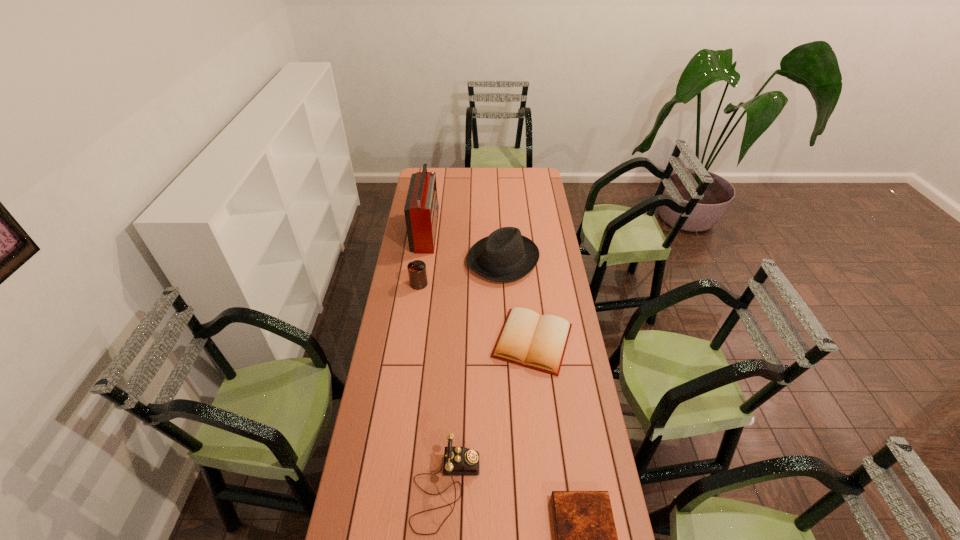
At what (x,y) coordinates should I click in order to perform the action: click on vacant space that satisfies the following two spatial constraints: 1. on the front-facing side of the can; 2. on the left side of the radio receiver. Please return your answer as a coordinate pair (x, y). This screenshot has width=960, height=540. Looking at the image, I should click on 419,284.

The height and width of the screenshot is (540, 960). In order to click on free space that satisfies the following two spatial constraints: 1. on the front-facing side of the radio receiver; 2. on the left side of the fifth tallest object in this screenshot , I will do `click(410, 341)`.

Where is `free space that satisfies the following two spatial constraints: 1. on the front-facing side of the tallest object; 2. on the back side of the fedora`? The image size is (960, 540). free space that satisfies the following two spatial constraints: 1. on the front-facing side of the tallest object; 2. on the back side of the fedora is located at coordinates click(x=422, y=260).

Where is `blank area in the image that satisfies the following two spatial constraints: 1. on the front side of the second shortest object; 2. on the dial of the third shortest object`? The width and height of the screenshot is (960, 540). blank area in the image that satisfies the following two spatial constraints: 1. on the front side of the second shortest object; 2. on the dial of the third shortest object is located at coordinates (549, 488).